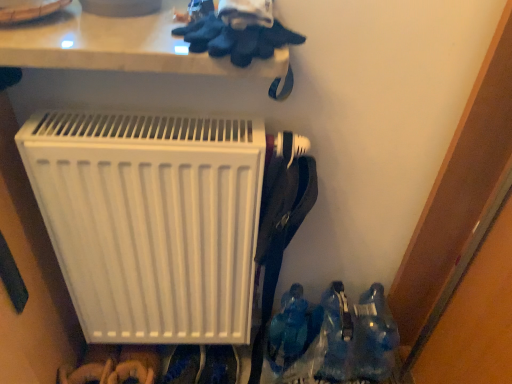
I want to click on white plastic radiator at center, so click(x=151, y=220).

What do you see at coordinates (151, 220) in the screenshot? The width and height of the screenshot is (512, 384). I see `white plastic radiator at center` at bounding box center [151, 220].

Describe the element at coordinates (348, 342) in the screenshot. I see `translucent plastic bottles at lower right` at that location.

Where is `translucent plastic bottles at lower right`? translucent plastic bottles at lower right is located at coordinates (348, 342).

What are the coordinates of `white plastic radiator at center` in the screenshot? It's located at (151, 220).

Considering the positions of objects white plastic radiator at center and translucent plastic bottles at lower right in the image provided, who is more to the right, white plastic radiator at center or translucent plastic bottles at lower right?

From the viewer's perspective, translucent plastic bottles at lower right appears more on the right side.

Is white plastic radiator at center in front of or behind translucent plastic bottles at lower right in the image?

In the image, white plastic radiator at center appears in front of translucent plastic bottles at lower right.

Does point (80, 150) come in front of point (327, 350)?

Yes, it is.

From the image's perspective, is white plastic radiator at center on translucent plastic bottles at lower right?

Yes, from the image's perspective, white plastic radiator at center is on top of translucent plastic bottles at lower right.

From a real-world perspective, relative to translucent plastic bottles at lower right, is white plastic radiator at center vertically above or below?

white plastic radiator at center is above translucent plastic bottles at lower right.

Between white plastic radiator at center and translucent plastic bottles at lower right, which one has smaller width?

With smaller width is white plastic radiator at center.

Between white plastic radiator at center and translucent plastic bottles at lower right, which one has less height?

translucent plastic bottles at lower right.

Consider the image. Considering the sizes of white plastic radiator at center and translucent plastic bottles at lower right in the image, is white plastic radiator at center bigger or smaller than translucent plastic bottles at lower right?

white plastic radiator at center is smaller than translucent plastic bottles at lower right.

Is translucent plastic bottles at lower right located within white plastic radiator at center?

No, translucent plastic bottles at lower right is not surrounded by white plastic radiator at center.

Are white plastic radiator at center and translucent plastic bottles at lower right beside each other?

There is a gap between white plastic radiator at center and translucent plastic bottles at lower right.

Is white plastic radiator at center facing towards translucent plastic bottles at lower right?

No, white plastic radiator at center is not aimed at translucent plastic bottles at lower right.

You are a GUI agent. You are given a task and a screenshot of the screen. Output one action in this format:
    pyautogui.click(x=<x>, y=<y>)
    Task: Click on the footwear located underneath the white plastic radiator at center (from a real-world perspective)
    The width and height of the screenshot is (512, 384).
    Given the screenshot: What is the action you would take?
    [348, 342]

Can you confirm if translucent plastic bottles at lower right is positioned to the right of white plastic radiator at center?

Correct, you'll find translucent plastic bottles at lower right to the right of white plastic radiator at center.

Which object is closer to the camera, translucent plastic bottles at lower right or white plastic radiator at center?

white plastic radiator at center is closer to the camera.

Is point (320, 336) positioned behind point (151, 266)?

That is True.

From the image's perspective, relative to white plastic radiator at center, is translucent plastic bottles at lower right above or below?

translucent plastic bottles at lower right is situated lower than white plastic radiator at center in the image.

From a real-world perspective, who is located lower, translucent plastic bottles at lower right or white plastic radiator at center?

translucent plastic bottles at lower right.

In terms of width, does translucent plastic bottles at lower right look wider or thinner when compared to white plastic radiator at center?

Clearly, translucent plastic bottles at lower right has more width compared to white plastic radiator at center.

Considering the relative sizes of translucent plastic bottles at lower right and white plastic radiator at center in the image provided, is translucent plastic bottles at lower right taller than white plastic radiator at center?

In fact, translucent plastic bottles at lower right may be shorter than white plastic radiator at center.

In the scene shown: Who is bigger, translucent plastic bottles at lower right or white plastic radiator at center?

translucent plastic bottles at lower right is bigger.

Is white plastic radiator at center surrounded by translucent plastic bottles at lower right?

That's incorrect, white plastic radiator at center is not inside translucent plastic bottles at lower right.

Does translucent plastic bottles at lower right touch white plastic radiator at center?

They are not placed beside each other.

Is translucent plastic bottles at lower right aimed at white plastic radiator at center?

No, translucent plastic bottles at lower right is not oriented towards white plastic radiator at center.

How far apart are translucent plastic bottles at lower right and white plastic radiator at center?

The distance of translucent plastic bottles at lower right from white plastic radiator at center is 14.62 inches.

You are a GUI agent. You are given a task and a screenshot of the screen. Output one action in this format:
    pyautogui.click(x=<x>, y=<y>)
    Task: Click on the home appliance lying on the left of translucent plastic bottles at lower right
    The width and height of the screenshot is (512, 384).
    Given the screenshot: What is the action you would take?
    pyautogui.click(x=151, y=220)

The image size is (512, 384). In order to click on home appliance above the translucent plastic bottles at lower right (from a real-world perspective) in this screenshot , I will do `click(151, 220)`.

Image resolution: width=512 pixels, height=384 pixels. Identify the location of footwear behind the white plastic radiator at center. (348, 342).